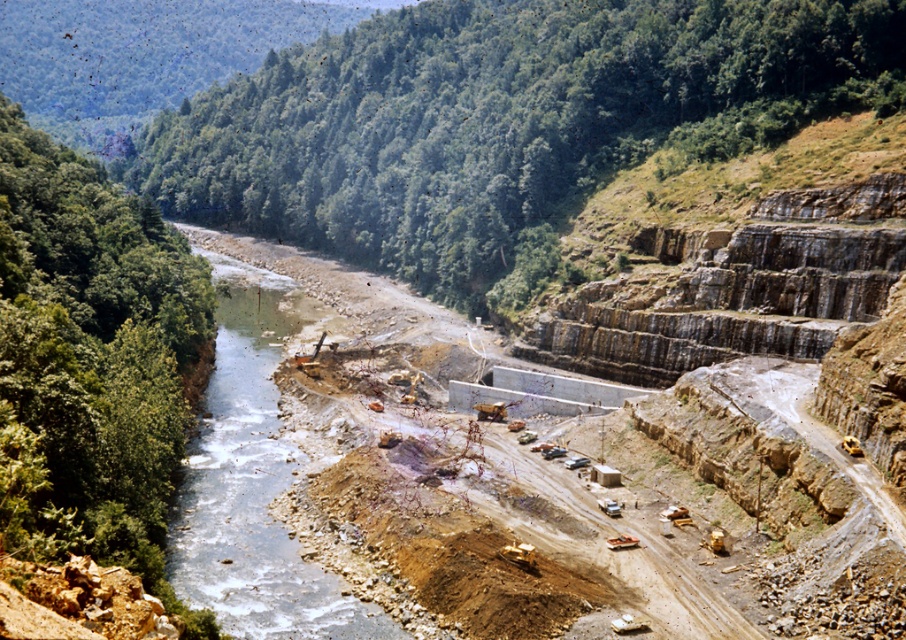
Question: Is clear water at center closer to camera compared to brown rocky construction site at center?

Choices:
 (A) no
 (B) yes

Answer: (A)

Question: Among these points, which one is farthest from the camera?

Choices:
 (A) (195, 244)
 (B) (737, 620)

Answer: (A)

Question: Can you confirm if clear water at center is thinner than brown rocky construction site at center?

Choices:
 (A) no
 (B) yes

Answer: (B)

Question: Where is clear water at center located in relation to brown rocky construction site at center in the image?

Choices:
 (A) below
 (B) above

Answer: (A)